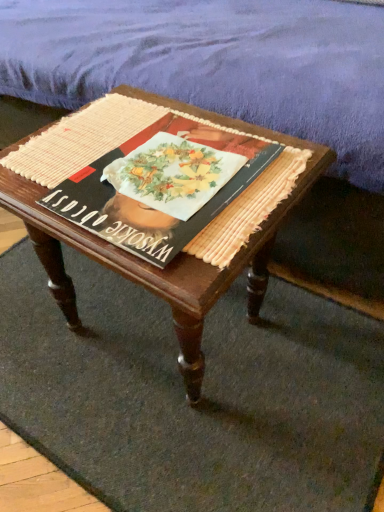
I want to click on free spot above matte black book at center (from a real-world perspective), so click(170, 169).